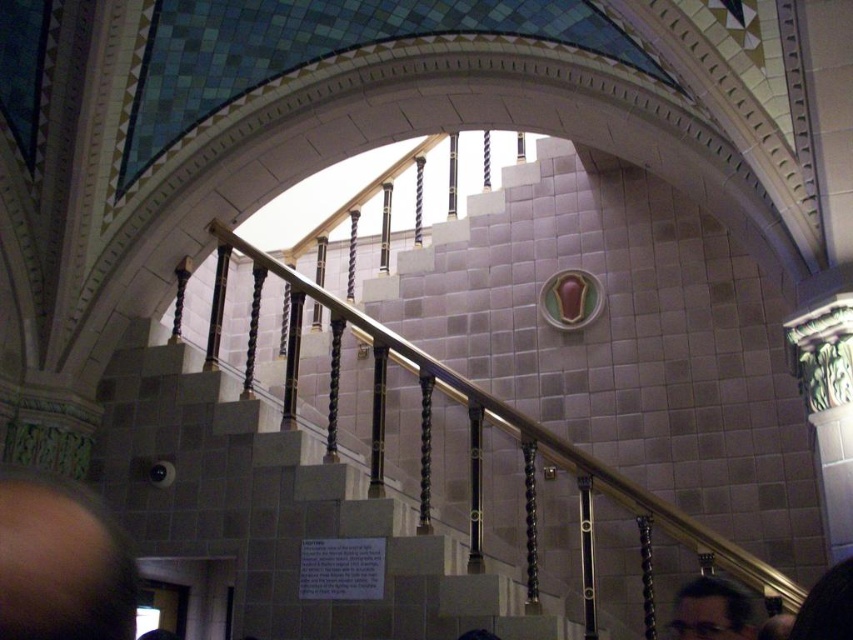
Question: Which point appears farthest from the camera in this image?

Choices:
 (A) (703, 634)
 (B) (67, 624)
 (C) (788, 637)
 (D) (221, 406)

Answer: (D)

Question: Which point is closer to the camera?

Choices:
 (A) dark brown hair at lower right
 (B) gray stone stairs at center
 (C) black hair at lower right

Answer: (C)

Question: Which of these objects is positioned farthest from the brown hair at lower left?

Choices:
 (A) black hair at lower right
 (B) gray stone stairs at center

Answer: (B)

Question: Is the position of gray stone stairs at center less distant than that of brown hair at lower left?

Choices:
 (A) no
 (B) yes

Answer: (A)

Question: Is gray stone stairs at center bigger than dark brown hair at lower right?

Choices:
 (A) yes
 (B) no

Answer: (A)

Question: Observing the image, what is the correct spatial positioning of dark brown hair at lower right in reference to black hair at lower right?

Choices:
 (A) right
 (B) left

Answer: (A)